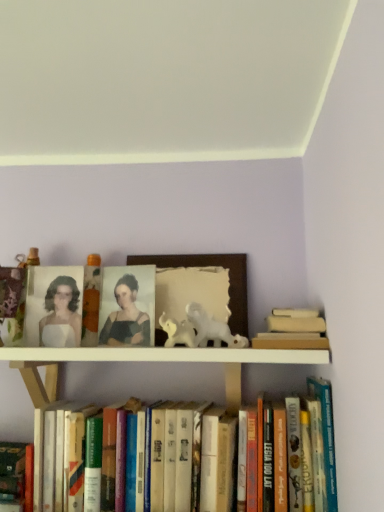
Question: From the image's perspective, is hardcover books at lower center, which ranks as the second book in right-to-left order, located above or below white glossy horse at center?

Choices:
 (A) below
 (B) above

Answer: (A)

Question: Is point (152, 440) closer or farther from the camera than point (182, 320)?

Choices:
 (A) farther
 (B) closer

Answer: (B)

Question: Which object is positioned closest to the matte black portrait at center?

Choices:
 (A) matte orange candle at upper center
 (B) matte white portrait at upper left
 (C) wooden picture frame at center
 (D) hardcover book at lower left, which is the first book from left to right
 (E) hardcover books at lower center, the 2th book positioned from the left

Answer: (A)

Question: Which is farther from the matte black portrait at center?

Choices:
 (A) wooden picture frame at center
 (B) white glossy horse at center
 (C) matte orange candle at upper center
 (D) matte white portrait at upper left
 (E) hardcover book at lower left, the third book when ordered from right to left

Answer: (E)